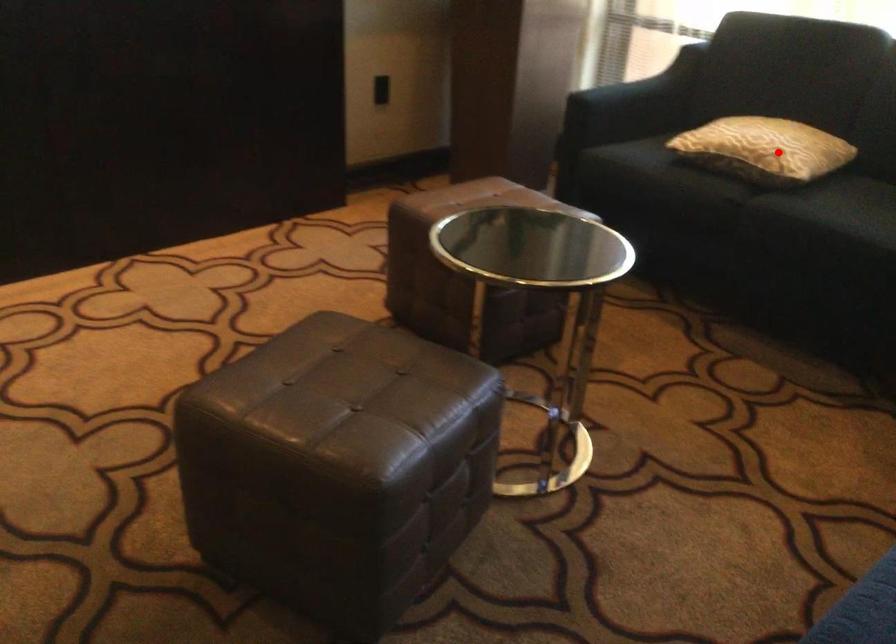
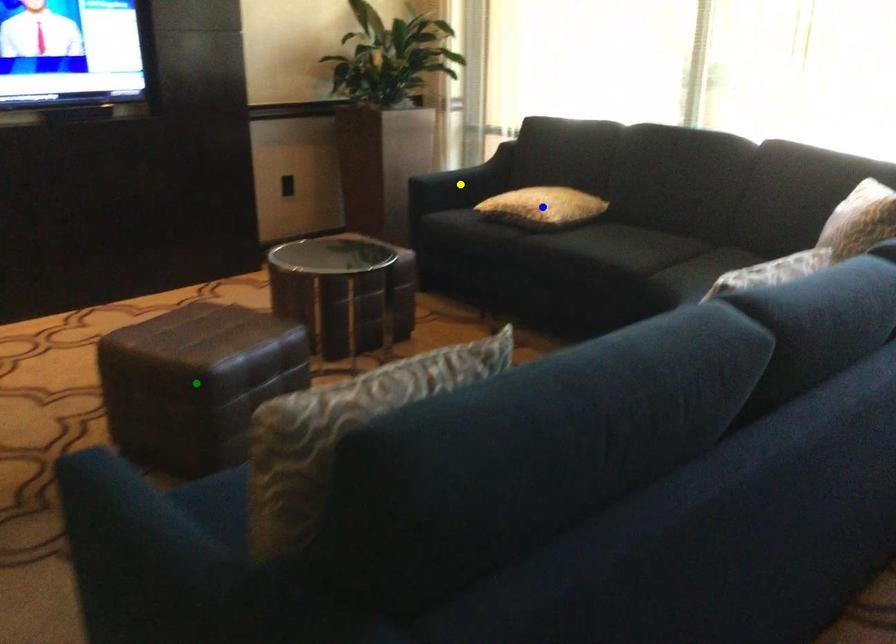
Question: I am providing you with two images of the same scene from different viewpoints. A red point is marked on the first image. You are given multiple points on the second image. Which mark in image 2 goes with the point in image 1?

Choices:
 (A) green point
 (B) yellow point
 (C) blue point

Answer: (C)